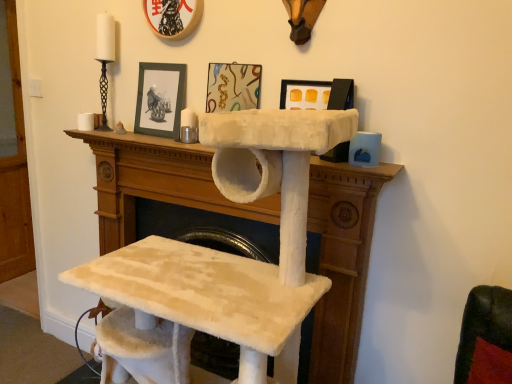
Question: Can you confirm if matte plastic picture frame at upper center, which is the second picture frame from left to right, is wider than white fluffy cat tree at center?

Choices:
 (A) yes
 (B) no

Answer: (B)

Question: Considering the relative sizes of matte plastic picture frame at upper center, which is the second picture frame from left to right, and white fluffy cat tree at center in the image provided, is matte plastic picture frame at upper center, which is the second picture frame from left to right, smaller than white fluffy cat tree at center?

Choices:
 (A) yes
 (B) no

Answer: (A)

Question: Is matte plastic picture frame at upper center, which is the second picture frame from left to right, closer to the viewer compared to white fluffy cat tree at center?

Choices:
 (A) no
 (B) yes

Answer: (A)

Question: Is matte plastic picture frame at upper center, which ranks as the second picture frame in right-to-left order, behind white fluffy cat tree at center?

Choices:
 (A) no
 (B) yes

Answer: (B)

Question: From the image's perspective, would you say matte plastic picture frame at upper center, which is the second picture frame from left to right, is shown under white fluffy cat tree at center?

Choices:
 (A) yes
 (B) no

Answer: (B)

Question: Can you confirm if matte plastic picture frame at upper center, which ranks as the second picture frame in right-to-left order, is thinner than white fluffy cat tree at center?

Choices:
 (A) yes
 (B) no

Answer: (A)

Question: Is matte black picture frame at upper center, which is the third picture frame in left-to-right order, positioned beyond the bounds of matte plastic picture frame at upper center, which ranks as the second picture frame in right-to-left order?

Choices:
 (A) no
 (B) yes

Answer: (B)

Question: Is matte black picture frame at upper center, which is the third picture frame in left-to-right order, bigger than matte plastic picture frame at upper center, which ranks as the second picture frame in right-to-left order?

Choices:
 (A) yes
 (B) no

Answer: (B)

Question: From the image's perspective, does matte black picture frame at upper center, which is the third picture frame in left-to-right order, appear lower than matte plastic picture frame at upper center, which ranks as the second picture frame in right-to-left order?

Choices:
 (A) no
 (B) yes

Answer: (B)

Question: From a real-world perspective, is matte black picture frame at upper center, which is counted as the first picture frame, starting from the right, under matte plastic picture frame at upper center, which is the second picture frame from left to right?

Choices:
 (A) yes
 (B) no

Answer: (A)

Question: Can you confirm if matte black picture frame at upper center, which is counted as the first picture frame, starting from the right, is taller than matte plastic picture frame at upper center, which is the second picture frame from left to right?

Choices:
 (A) no
 (B) yes

Answer: (A)

Question: Is matte black picture frame at upper center, which is the third picture frame in left-to-right order, to the left of matte plastic picture frame at upper center, which is the second picture frame from left to right, from the viewer's perspective?

Choices:
 (A) no
 (B) yes

Answer: (A)

Question: Considering the relative sizes of white fluffy cat tree at center and black matte picture frame at upper center, the 1th picture frame from the left, in the image provided, is white fluffy cat tree at center bigger than black matte picture frame at upper center, the 1th picture frame from the left,?

Choices:
 (A) yes
 (B) no

Answer: (A)